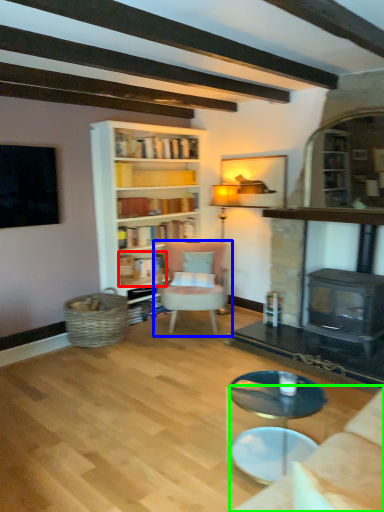
Question: Estimate the real-world distances between objects in this image. Which object is closer to book (highlighted by a red box), chair (highlighted by a blue box) or studio couch (highlighted by a green box)?

Choices:
 (A) chair
 (B) studio couch

Answer: (A)